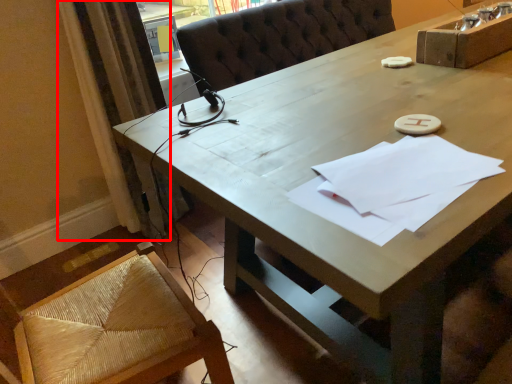
Question: In this image, where is curtain (annotated by the red box) located relative to notepad?

Choices:
 (A) left
 (B) right

Answer: (A)